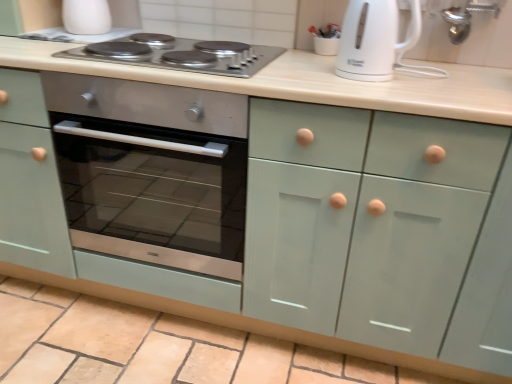
Where is `blank space to the left of white glossy electric kettle at upper right`? This screenshot has width=512, height=384. blank space to the left of white glossy electric kettle at upper right is located at coordinates (301, 73).